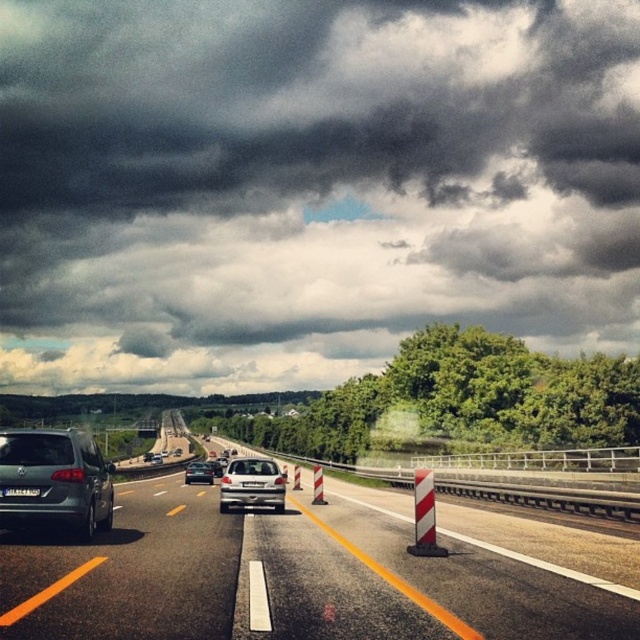
You are a driver approaching the highway and see the metallic silver car at center ahead. There is a dark gray cloud at upper center in the sky. Which object is higher from the ground?

The dark gray cloud at upper center is taller than the metallic silver car at center, so the dark gray cloud at upper center is higher from the ground.

Based on the photo, you are a drone operator trying to capture the dark gray cloud at upper center. Your camera has a 100mm lens with a field of view of 50 degrees. If the cloud is at coordinates 0.287, 0.484 in the image, can you estimate whether the cloud is within the camera frame?

The dark gray cloud at upper center is located at coordinates (308,182). Since the camera has a 50 degree field of view, and the cloud is within the central portion of the image, it is likely within the frame.

You are a weather drone tasked with monitoring cloud formations. You need to fly from your current position at point A to the dark gray cloud at upper center. Which direction should you head to reach it first?

The dark gray cloud at upper center is located at point [308,182], so you should head towards the upper center direction to reach it first.